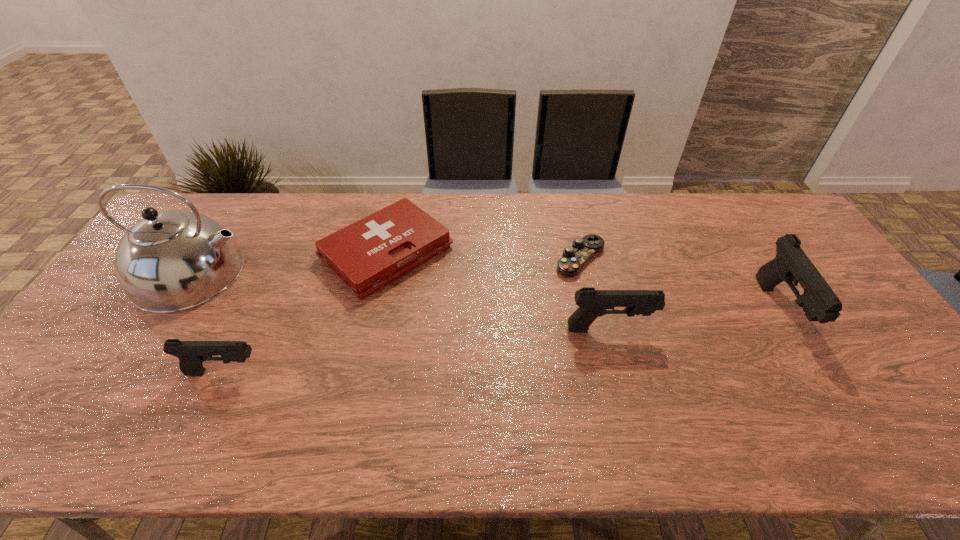
Find the location of `the leftmost pistol`. the leftmost pistol is located at coordinates (191, 354).

Locate an element on the screen. the fourth tallest object is located at coordinates (191, 354).

Identify the location of the fourth shortest object. (592, 303).

You are a GUI agent. You are given a task and a screenshot of the screen. Output one action in this format:
    pyautogui.click(x=<x>, y=<y>)
    Task: Click on the second tallest pistol
    Image resolution: width=960 pixels, height=540 pixels.
    Given the screenshot: What is the action you would take?
    pyautogui.click(x=592, y=303)

Locate an element on the screen. This screenshot has height=540, width=960. the rightmost pistol is located at coordinates (791, 264).

You are a GUI agent. You are given a task and a screenshot of the screen. Output one action in this format:
    pyautogui.click(x=<x>, y=<y>)
    Task: Click on the second shortest object
    This screenshot has height=540, width=960.
    Given the screenshot: What is the action you would take?
    pyautogui.click(x=367, y=255)

I want to click on the fourth object from right to left, so [x=367, y=255].

Identify the location of kettle. (171, 261).

Locate an element on the screen. control is located at coordinates (574, 257).

Locate an element on the screen. The height and width of the screenshot is (540, 960). free space located at the barrel of the fourth tallest object is located at coordinates (291, 373).